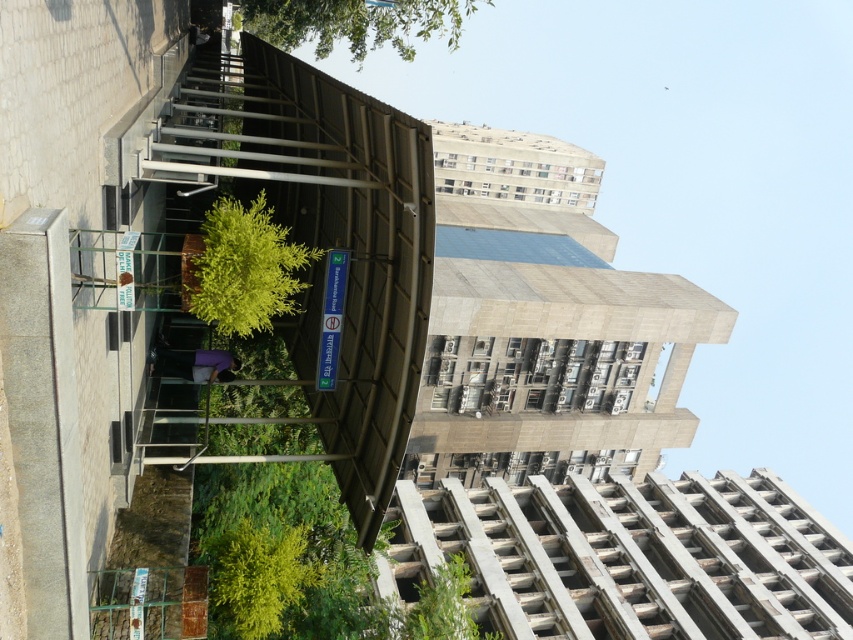
You are a city planner analyzing the urban scene. You need to determine which of the two green leafy trees, the green leafy tree at center or the green leafy tree at upper center, is narrower. Which one is it?

The green leafy tree at center has a lesser width compared to the green leafy tree at upper center, so the green leafy tree at center is narrower.